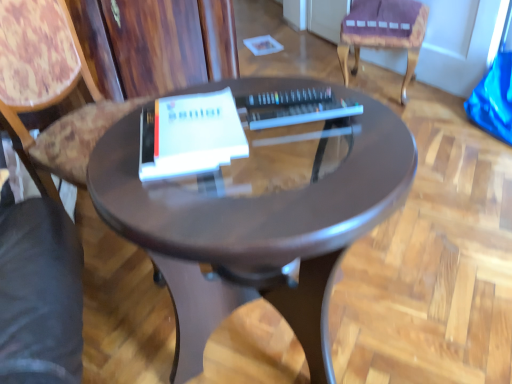
Locate an element on the screen. free point to the right of glossy brown table at center is located at coordinates (430, 275).